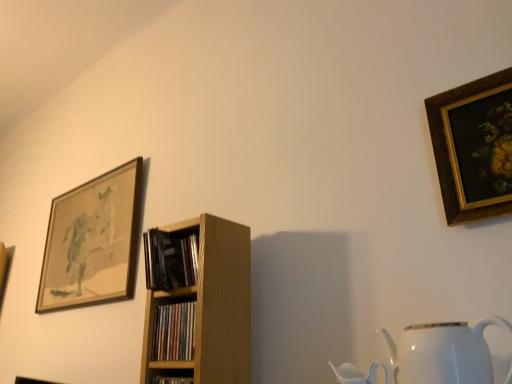
Question: Would you say white glossy jug at lower right contains gold-framed painting at upper right, arranged as the 2th picture frame when viewed from the left?

Choices:
 (A) no
 (B) yes

Answer: (A)

Question: Considering the relative sizes of white glossy jug at lower right and gold-framed painting at upper right, arranged as the 2th picture frame when viewed from the left, in the image provided, is white glossy jug at lower right taller than gold-framed painting at upper right, arranged as the 2th picture frame when viewed from the left,?

Choices:
 (A) yes
 (B) no

Answer: (B)

Question: Considering the relative positions of white glossy jug at lower right and gold-framed painting at upper right, arranged as the 2th picture frame when viewed from the left, in the image provided, is white glossy jug at lower right to the left of gold-framed painting at upper right, arranged as the 2th picture frame when viewed from the left, from the viewer's perspective?

Choices:
 (A) no
 (B) yes

Answer: (B)

Question: Is white glossy jug at lower right further to the viewer compared to gold-framed painting at upper right, which is the 2th picture frame in back-to-front order?

Choices:
 (A) yes
 (B) no

Answer: (B)

Question: Is white glossy jug at lower right facing towards gold-framed painting at upper right, the 1th picture frame positioned from the front?

Choices:
 (A) yes
 (B) no

Answer: (B)

Question: In terms of height, does wooden shelf at center look taller or shorter compared to wooden framed artwork at upper left, which is the first picture frame in back-to-front order?

Choices:
 (A) tall
 (B) short

Answer: (B)

Question: From a real-world perspective, relative to wooden framed artwork at upper left, which is the first picture frame in back-to-front order, is wooden shelf at center vertically above or below?

Choices:
 (A) below
 (B) above

Answer: (A)

Question: Considering their positions, is wooden shelf at center located in front of or behind wooden framed artwork at upper left, the second picture frame viewed from the right?

Choices:
 (A) behind
 (B) front

Answer: (B)

Question: Considering the positions of wooden shelf at center and wooden framed artwork at upper left, the 1th picture frame from the left, in the image, is wooden shelf at center wider or thinner than wooden framed artwork at upper left, the 1th picture frame from the left,?

Choices:
 (A) thin
 (B) wide

Answer: (B)

Question: Considering the positions of white glossy jug at lower right and gold-framed painting at upper right, arranged as the 2th picture frame when viewed from the left, in the image, is white glossy jug at lower right wider or thinner than gold-framed painting at upper right, arranged as the 2th picture frame when viewed from the left,?

Choices:
 (A) wide
 (B) thin

Answer: (A)

Question: Is white glossy jug at lower right in front of or behind gold-framed painting at upper right, arranged as the 2th picture frame when viewed from the left, in the image?

Choices:
 (A) behind
 (B) front

Answer: (B)

Question: Is white glossy jug at lower right situated inside gold-framed painting at upper right, the 1th picture frame positioned from the front, or outside?

Choices:
 (A) inside
 (B) outside

Answer: (B)

Question: In the image, is white glossy jug at lower right on the left side or the right side of gold-framed painting at upper right, which is the 2th picture frame in back-to-front order?

Choices:
 (A) right
 (B) left

Answer: (B)

Question: Is wooden bookshelf at center, acting as the first book starting from the bottom, inside the boundaries of wooden shelf at center, or outside?

Choices:
 (A) inside
 (B) outside

Answer: (B)

Question: Would you say wooden bookshelf at center, positioned as the second book in top-to-bottom order, is to the left or to the right of wooden shelf at center in the picture?

Choices:
 (A) left
 (B) right

Answer: (A)